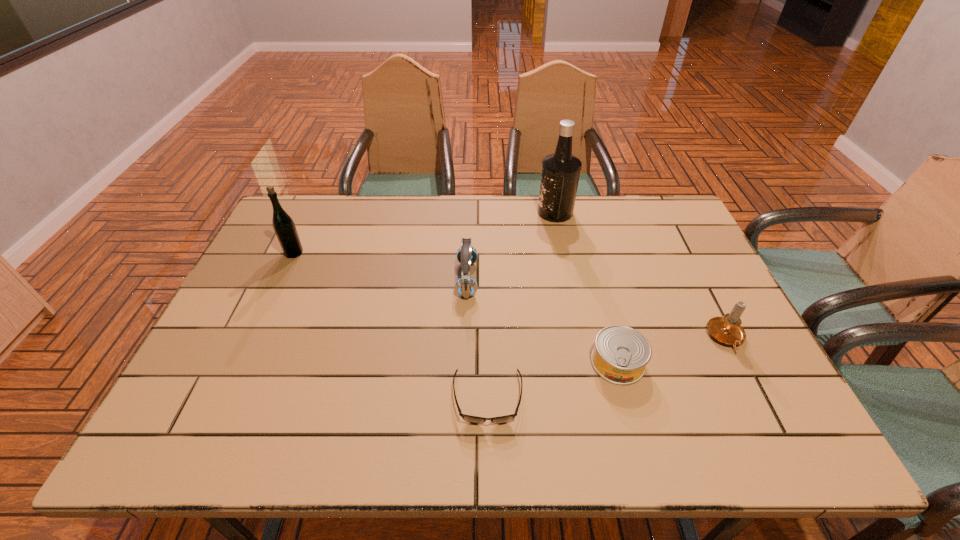
I want to click on liquor, so click(x=560, y=174).

Locate an element on the screen. The height and width of the screenshot is (540, 960). the tallest object is located at coordinates (560, 174).

Find the location of a particular element. The width and height of the screenshot is (960, 540). beer bottle is located at coordinates (283, 225).

Find the location of `the leftmost object`. the leftmost object is located at coordinates (283, 225).

This screenshot has width=960, height=540. Find the location of `headset`. headset is located at coordinates (465, 286).

I want to click on the rightmost object, so [727, 329].

Locate an element on the screen. the second shortest object is located at coordinates (621, 353).

At what (x,y) coordinates should I click in order to perform the action: click on sunglasses. Please return your answer as a coordinate pair (x, y). The width and height of the screenshot is (960, 540). Looking at the image, I should click on (468, 418).

You are a GUI agent. You are given a task and a screenshot of the screen. Output one action in this format:
    pyautogui.click(x=<x>, y=<y>)
    Task: Click on the vacant space located 0.170m on the front label of the farthest object
    This screenshot has width=960, height=540.
    Given the screenshot: What is the action you would take?
    pyautogui.click(x=488, y=212)

Locate an element on the screen. This screenshot has width=960, height=540. free region located 0.230m on the front label of the farthest object is located at coordinates (470, 212).